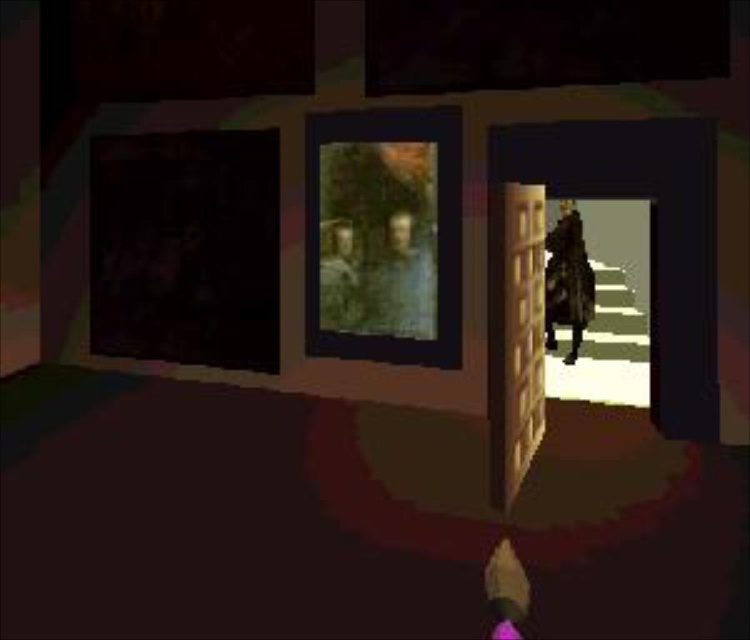
Question: Does olive green fabric portrait at center have a lesser width compared to green camouflage jacket at center?

Choices:
 (A) no
 (B) yes

Answer: (A)

Question: Which point appears farthest from the camera in this image?

Choices:
 (A) (399, 330)
 (B) (342, 228)

Answer: (B)

Question: Which of the following is the farthest from the observer?

Choices:
 (A) olive green fabric portrait at center
 (B) leather jacket at center

Answer: (B)

Question: Does leather jacket at center appear on the right side of green camouflage jacket at center?

Choices:
 (A) yes
 (B) no

Answer: (A)

Question: Which of the following is the farthest from the observer?

Choices:
 (A) (573, 358)
 (B) (375, 307)

Answer: (A)

Question: Can you confirm if olive green fabric portrait at center is bigger than green camouflage jacket at center?

Choices:
 (A) yes
 (B) no

Answer: (A)